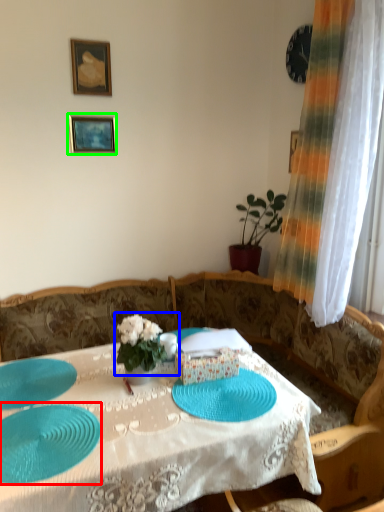
Question: Which is farther away from glass plate (highlighted by a red box)? floral arrangement (highlighted by a blue box) or picture frame (highlighted by a green box)?

Choices:
 (A) floral arrangement
 (B) picture frame

Answer: (B)